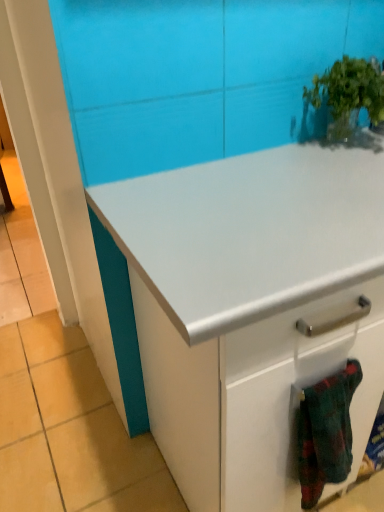
What are the coordinates of `free space above white glossy cabinet at center (from a real-world perspective)` in the screenshot? It's located at (288, 192).